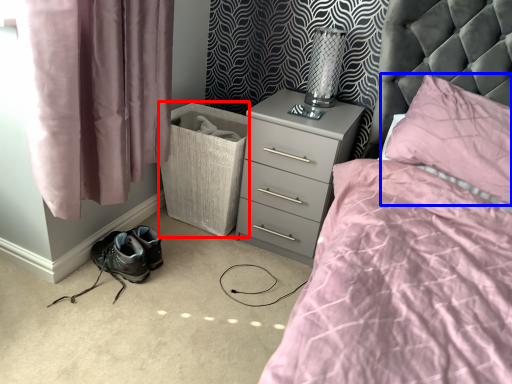
Question: Which point is closer to the camera, laundry basket (highlighted by a red box) or pillow (highlighted by a blue box)?

Choices:
 (A) laundry basket
 (B) pillow

Answer: (B)